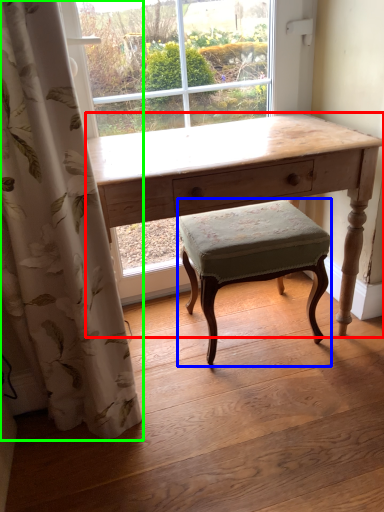
Question: Estimate the real-world distances between objects in this image. Which object is closer to desk (highlighted by a red box), stool (highlighted by a blue box) or curtain (highlighted by a green box)?

Choices:
 (A) stool
 (B) curtain

Answer: (A)